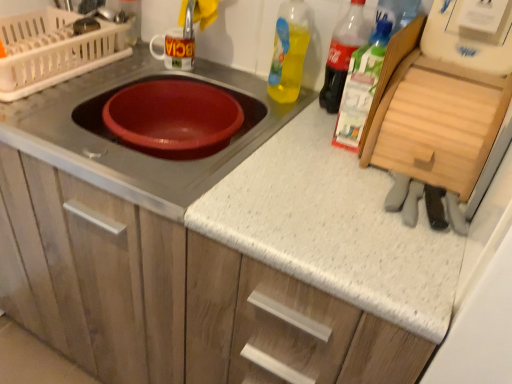
Find the location of `vacant space to the left of translucent plastic bottle at upper right, which is the first bottle from right to left`. vacant space to the left of translucent plastic bottle at upper right, which is the first bottle from right to left is located at coordinates (303, 127).